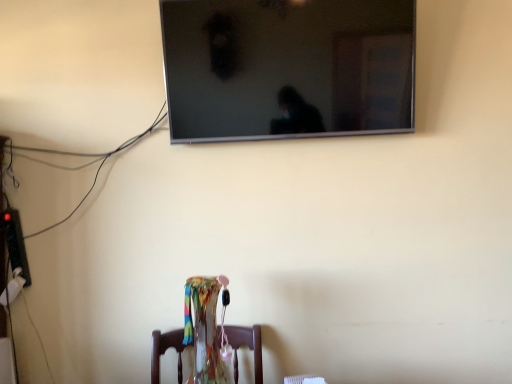
The image size is (512, 384). Describe the element at coordinates (288, 68) in the screenshot. I see `flat screen tv at upper center` at that location.

Locate an element on the screen. flat screen tv at upper center is located at coordinates (288, 68).

The image size is (512, 384). Describe the element at coordinates (247, 346) in the screenshot. I see `transparent glass vase at center` at that location.

At what (x,y) coordinates should I click in order to perform the action: click on transparent glass vase at center. Please return your answer as a coordinate pair (x, y). Image resolution: width=512 pixels, height=384 pixels. Looking at the image, I should click on (247, 346).

You are a GUI agent. You are given a task and a screenshot of the screen. Output one action in this format:
    pyautogui.click(x=<x>, y=<y>)
    Task: Click on the flat screen tv at upper center
    Image resolution: width=512 pixels, height=384 pixels.
    Given the screenshot: What is the action you would take?
    pyautogui.click(x=288, y=68)

Considering the relative positions of transparent glass vase at center and flat screen tv at upper center in the image provided, is transparent glass vase at center to the left or to the right of flat screen tv at upper center?

transparent glass vase at center is positioned on flat screen tv at upper center's left side.

Does transparent glass vase at center come in front of flat screen tv at upper center?

Yes.

Which point is more distant from viewer, (254, 332) or (387, 66)?

The point (254, 332) is farther.

From the image's perspective, who appears lower, transparent glass vase at center or flat screen tv at upper center?

transparent glass vase at center appears lower in the image.

From a real-world perspective, which object stands above the other?

flat screen tv at upper center.

In the scene shown: Considering the sizes of objects transparent glass vase at center and flat screen tv at upper center in the image provided, who is thinner, transparent glass vase at center or flat screen tv at upper center?

With smaller width is flat screen tv at upper center.

Who is taller, transparent glass vase at center or flat screen tv at upper center?

Standing taller between the two is flat screen tv at upper center.

Looking at the image, does transparent glass vase at center seem bigger or smaller compared to flat screen tv at upper center?

Considering their sizes, transparent glass vase at center takes up less space than flat screen tv at upper center.

Is transparent glass vase at center completely or partially outside of flat screen tv at upper center?

transparent glass vase at center lies outside flat screen tv at upper center's area.

Is transparent glass vase at center beside flat screen tv at upper center?

No, transparent glass vase at center is not touching flat screen tv at upper center.

Is transparent glass vase at center facing towards flat screen tv at upper center?

No, transparent glass vase at center is not turned towards flat screen tv at upper center.

Where is `television above the transparent glass vase at center (from the image's perspective)`? The height and width of the screenshot is (384, 512). television above the transparent glass vase at center (from the image's perspective) is located at coordinates (288, 68).

Is flat screen tv at upper center to the right of transparent glass vase at center from the viewer's perspective?

Yes, flat screen tv at upper center is to the right of transparent glass vase at center.

Which is in front, flat screen tv at upper center or transparent glass vase at center?

transparent glass vase at center.

Which is nearer, [338,98] or [154,375]?

Clearly, point [338,98] is closer to the camera than point [154,375].

From the image's perspective, is flat screen tv at upper center above or below transparent glass vase at center?

flat screen tv at upper center is above transparent glass vase at center.

From a real-world perspective, is flat screen tv at upper center on transparent glass vase at center?

Yes, from a real-world perspective, flat screen tv at upper center is over transparent glass vase at center

Does flat screen tv at upper center have a lesser width compared to transparent glass vase at center?

Yes, flat screen tv at upper center is thinner than transparent glass vase at center.

Is flat screen tv at upper center taller than transparent glass vase at center?

Indeed, flat screen tv at upper center has a greater height compared to transparent glass vase at center.

Considering the sizes of flat screen tv at upper center and transparent glass vase at center in the image, is flat screen tv at upper center bigger or smaller than transparent glass vase at center?

flat screen tv at upper center is bigger than transparent glass vase at center.

From the picture: Is flat screen tv at upper center completely or partially outside of transparent glass vase at center?

flat screen tv at upper center is positioned outside transparent glass vase at center.

Are flat screen tv at upper center and transparent glass vase at center located far from each other?

flat screen tv at upper center is near transparent glass vase at center, not far away.

Is transparent glass vase at center at the back of flat screen tv at upper center?

No, flat screen tv at upper center is not facing away from transparent glass vase at center.

This screenshot has height=384, width=512. What are the coordinates of `television on the right of transparent glass vase at center` in the screenshot? It's located at (288, 68).

What are the coordinates of `television on the right side of transparent glass vase at center` in the screenshot? It's located at (288, 68).

Where is `television behind the transparent glass vase at center`? This screenshot has width=512, height=384. television behind the transparent glass vase at center is located at coordinates (288, 68).